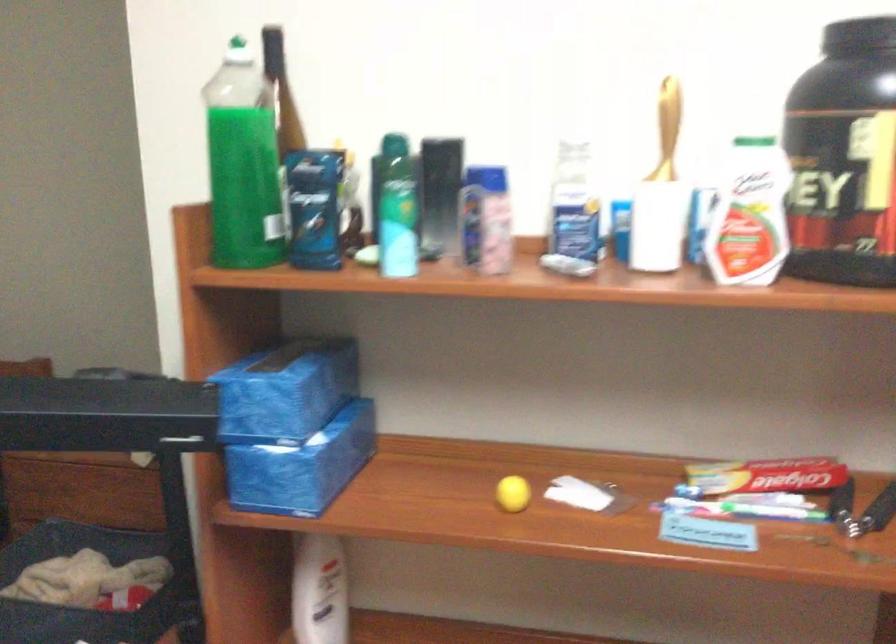
Which object does [319,591] point to?

This point indicates the white lotion bottle.